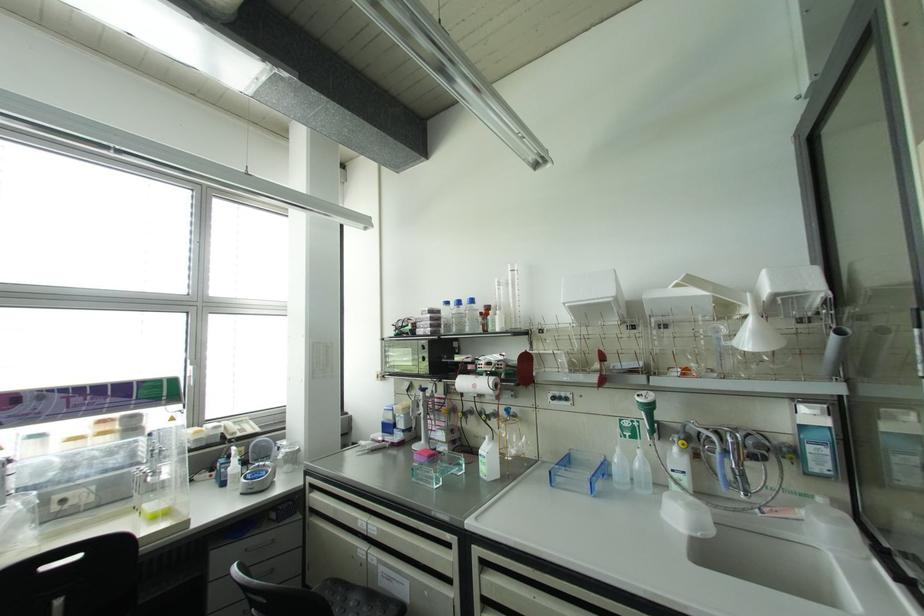
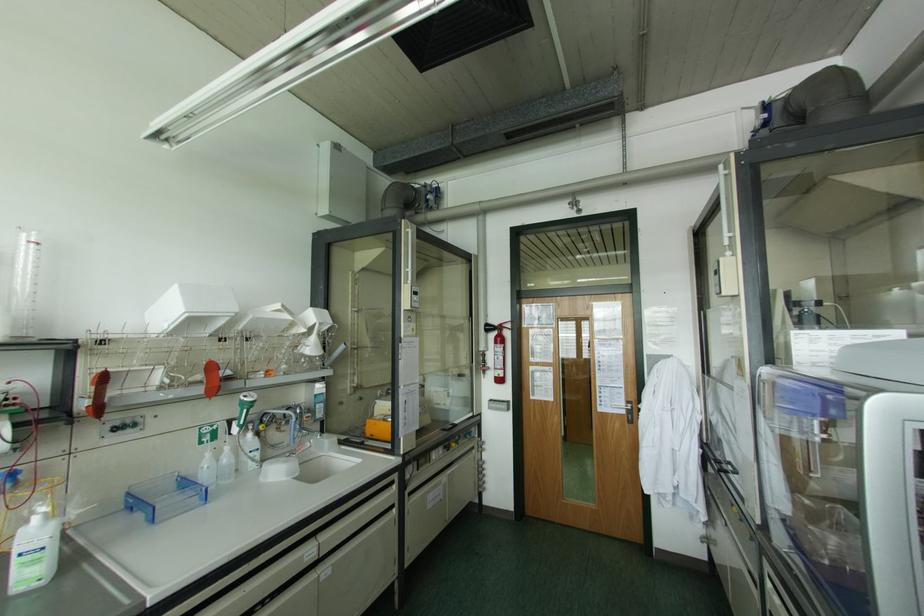
Locate, in the second image, the point that corresponds to (526,358) in the first image.

(102, 379)